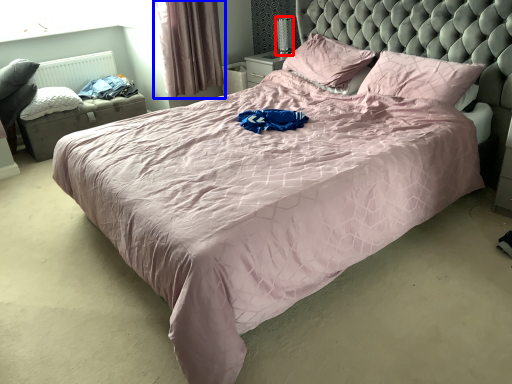
Question: Which point is further to the camera, table lamp (highlighted by a red box) or curtain (highlighted by a blue box)?

Choices:
 (A) table lamp
 (B) curtain

Answer: (A)